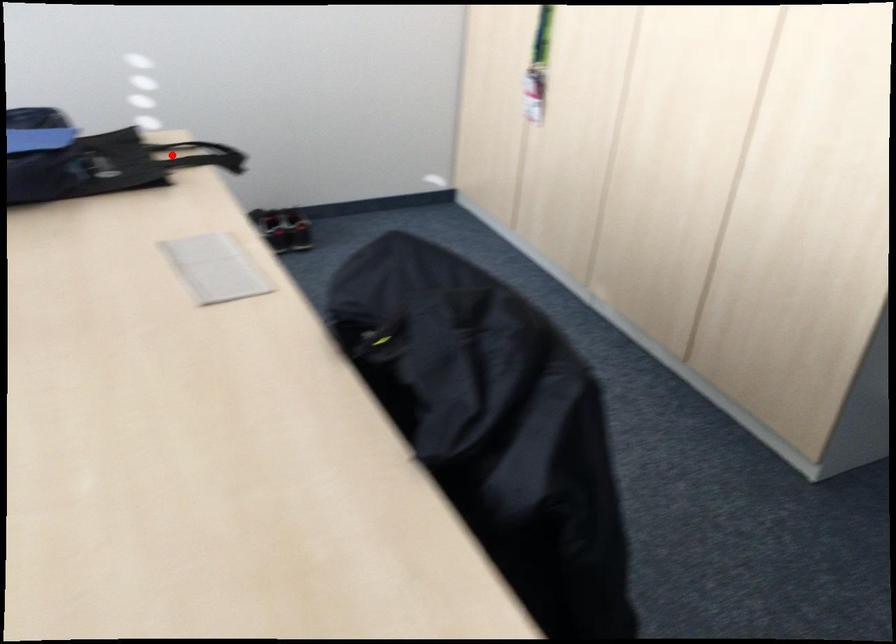
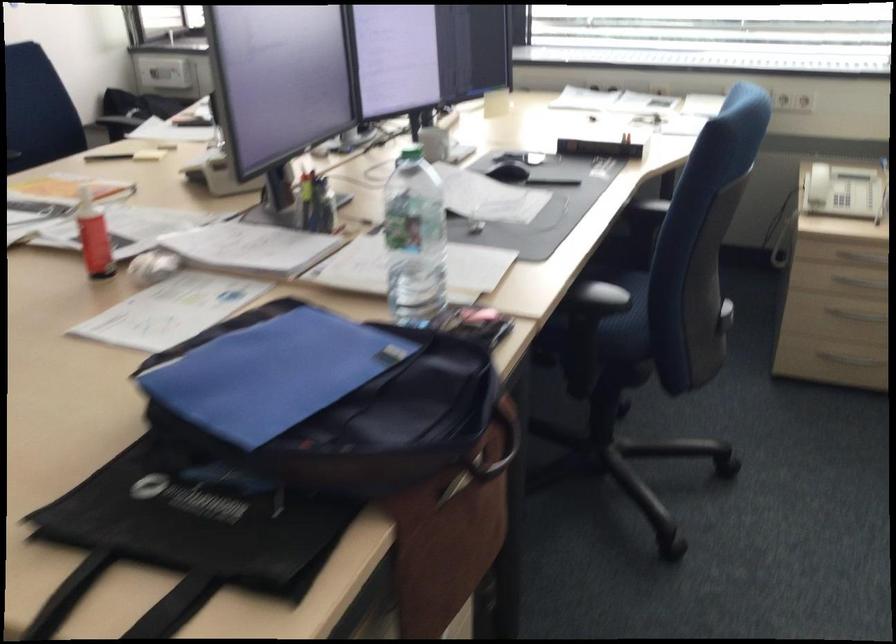
The point at the highlighted location is marked in the first image. Where is the corresponding point in the second image?

(124, 601)